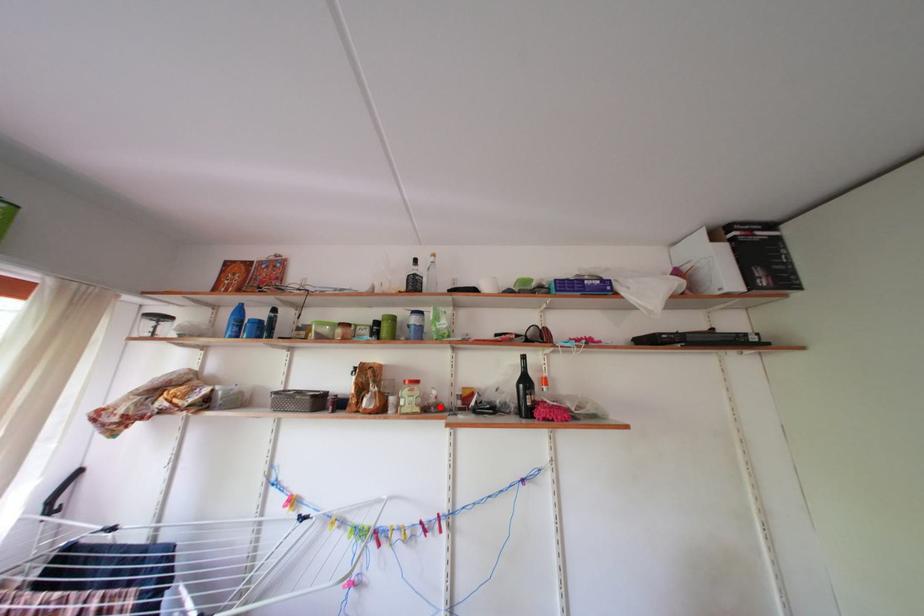
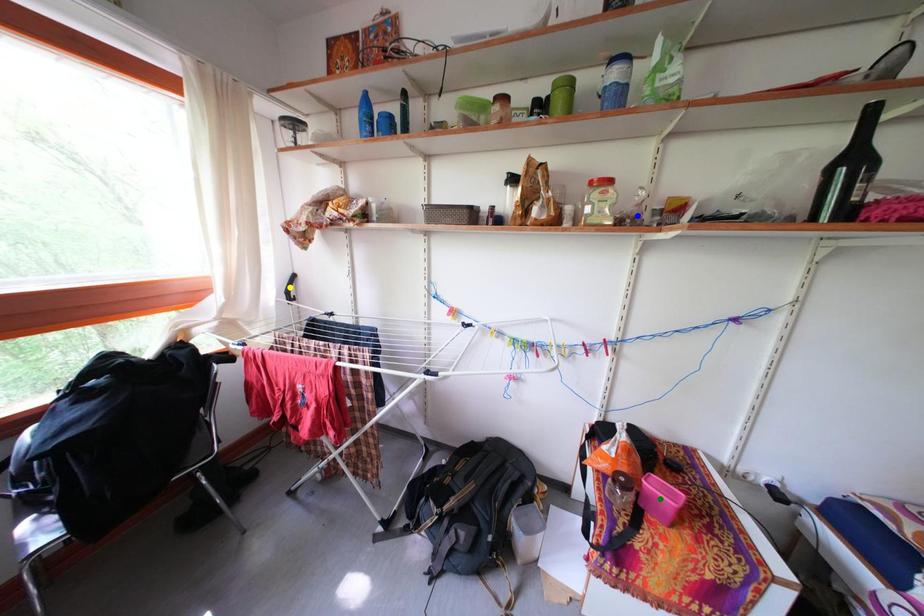
Question: I am providing you with two images of the same scene from different viewpoints. A red point is marked on the first image. You are given multiple points on the second image. Can you choose the point in image 2 that corresponds to the point in image 1?

Choices:
 (A) green point
 (B) blue point
 (C) yellow point

Answer: (B)